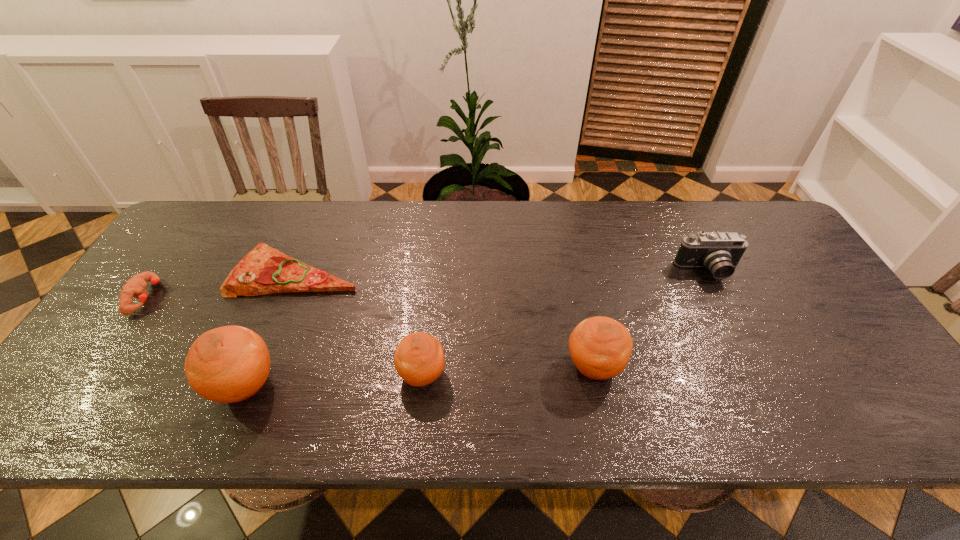
Where is `vacant space located on the right of the shortest orange`? The width and height of the screenshot is (960, 540). vacant space located on the right of the shortest orange is located at coordinates (605, 375).

Where is `vacant position located on the right of the fifth object from left to right`? vacant position located on the right of the fifth object from left to right is located at coordinates (690, 366).

What are the coordinates of `vacant space located 0.130m with the gloves of the fifth tallest object facing forward` in the screenshot? It's located at (206, 297).

Identify the location of blank space located on the right of the pizza. The width and height of the screenshot is (960, 540). (399, 272).

Identify the location of vacant area situated 0.140m on the front-facing side of the camera. Image resolution: width=960 pixels, height=540 pixels. (735, 324).

At what (x,y) coordinates should I click in order to perform the action: click on object that is positioned at the far edge. Please return your answer as a coordinate pair (x, y). This screenshot has height=540, width=960. Looking at the image, I should click on (264, 270).

This screenshot has height=540, width=960. What are the coordinates of `object located at the left edge` in the screenshot? It's located at (135, 287).

Identify the location of free space at the far edge of the desktop. (581, 205).

At what (x,y) coordinates should I click in order to perform the action: click on free space at the right edge of the desktop. Please return your answer as a coordinate pair (x, y). Looking at the image, I should click on (798, 281).

Identify the location of vacant region at the far left corner of the desktop. (216, 218).